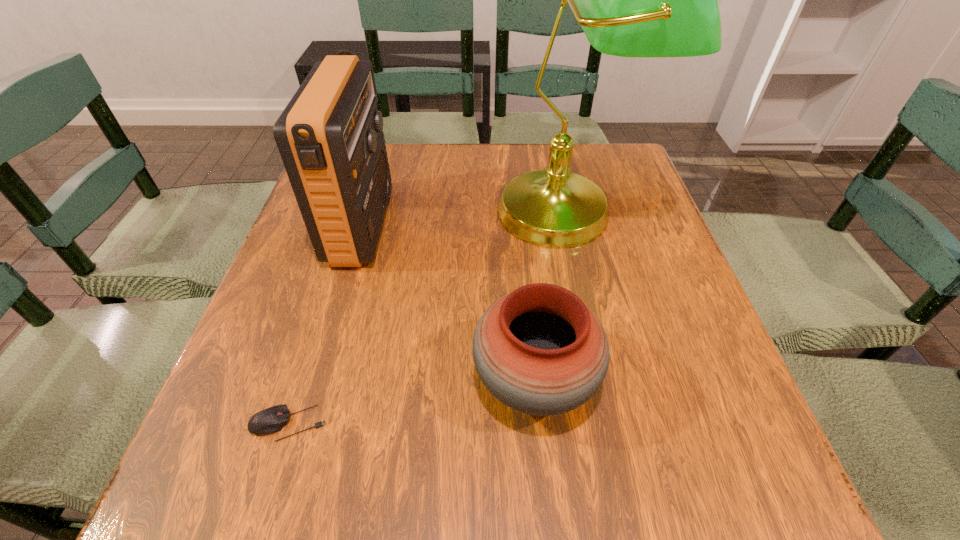
The width and height of the screenshot is (960, 540). Identify the location of lamp. (632, 0).

You are a GUI agent. You are given a task and a screenshot of the screen. Output one action in this format:
    pyautogui.click(x=<x>, y=<y>)
    Task: Click on the radio receiver
    This screenshot has height=540, width=960.
    Given the screenshot: What is the action you would take?
    pyautogui.click(x=330, y=136)

Locate an element on the screen. The width and height of the screenshot is (960, 540). the third tallest object is located at coordinates pos(539,350).

Where is `mouse`? This screenshot has height=540, width=960. mouse is located at coordinates (271, 420).

At what (x,y) coordinates should I click in order to perform the action: click on vacant space located on the desk next to the lamp. Please return your answer as a coordinate pair (x, y). This screenshot has height=540, width=960. Looking at the image, I should click on (586, 296).

The image size is (960, 540). Find the location of `vacant space located 0.250m on the front-facing side of the radio receiver`. vacant space located 0.250m on the front-facing side of the radio receiver is located at coordinates (493, 226).

You are a GUI agent. You are given a task and a screenshot of the screen. Output one action in this format:
    pyautogui.click(x=<x>, y=<y>)
    Task: Click on the free location located 0.110m on the right of the pottery
    Image resolution: width=960 pixels, height=540 pixels.
    Given the screenshot: What is the action you would take?
    pyautogui.click(x=661, y=381)

Locate an element on the screen. The width and height of the screenshot is (960, 540). vacant space located 0.250m on the right of the mouse is located at coordinates (486, 423).

Locate an element on the screen. This screenshot has width=960, height=540. lamp that is at the far edge is located at coordinates (632, 0).

Image resolution: width=960 pixels, height=540 pixels. In order to click on radio receiver positioned at the far edge in this screenshot , I will do `click(330, 136)`.